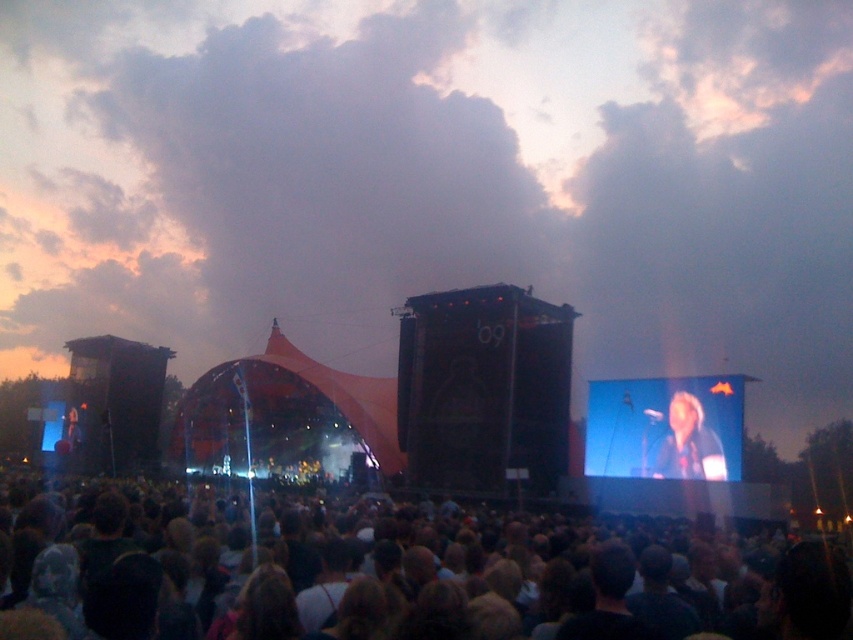
Is point (103, 74) closer to camera compared to point (361, 634)?

That is False.

Based on the photo, measure the distance between point (844, 300) and camera.

They are 131.94 meters apart.

Who is more forward, (x=376, y=97) or (x=323, y=611)?

Point (x=323, y=611) is more forward.

Locate an element on the screen. The image size is (853, 640). cloudy sky at upper center is located at coordinates (434, 179).

Who is positioned more to the left, cloudy sky at upper center or matte black microphone at center?

cloudy sky at upper center is more to the left.

Does cloudy sky at upper center appear over matte black microphone at center?

Correct, cloudy sky at upper center is located above matte black microphone at center.

Is point (265, 113) farther from viewer compared to point (729, 385)?

That is True.

Where is `cloudy sky at upper center`? The height and width of the screenshot is (640, 853). cloudy sky at upper center is located at coordinates (434, 179).

Does point (639, 410) come in front of point (67, 424)?

Yes, it is in front of point (67, 424).

In order to click on matte black microphone at center in this screenshot , I will do `click(665, 428)`.